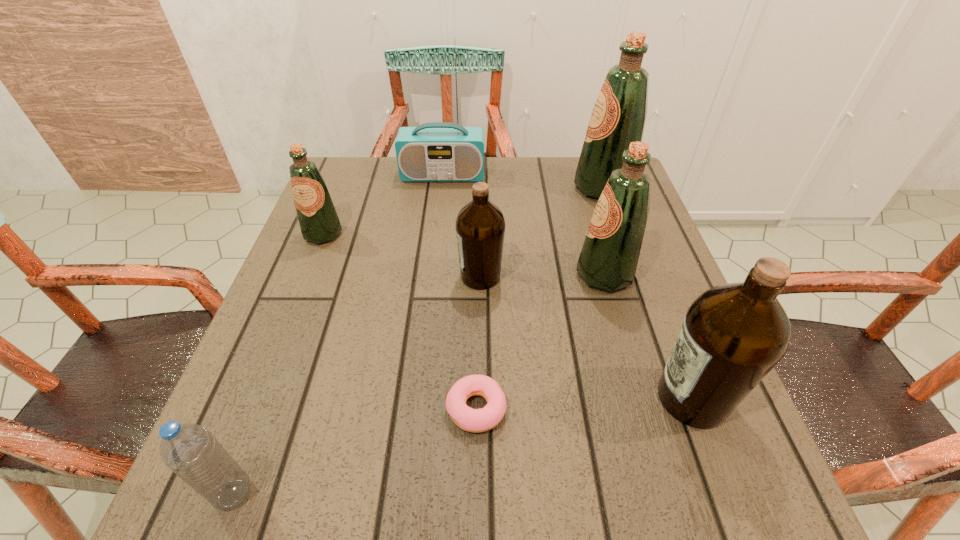
This screenshot has height=540, width=960. I want to click on vacant area that lies between the second olive oil from left to right and the sixth nearest object, so click(402, 255).

Where is `free space between the right brown olive oil and the shortest object`? The width and height of the screenshot is (960, 540). free space between the right brown olive oil and the shortest object is located at coordinates [x=584, y=403].

Find the location of a particular element. free area in between the second shortest object and the second smallest green olive oil is located at coordinates (420, 384).

Locate an element on the screen. free space between the tallest olive oil and the right brown olive oil is located at coordinates pyautogui.click(x=647, y=293).

What are the coordinates of `free spot between the left brown olive oil and the doughnut` in the screenshot? It's located at (478, 342).

Find the location of a particular element. This screenshot has width=960, height=540. vacant area between the radio receiver and the right brown olive oil is located at coordinates (567, 287).

At what (x,y) coordinates should I click in order to perform the action: click on free point between the light radio receiver and the shortest object. Please return your answer as a coordinate pair (x, y). This screenshot has width=960, height=540. Looking at the image, I should click on (460, 292).

At what (x,y) coordinates should I click in order to perform the action: click on empty location between the pink doughnut and the smaller brown olive oil. Please return your answer as a coordinate pair (x, y). The height and width of the screenshot is (540, 960). Looking at the image, I should click on (478, 342).

Where is `free space between the second farthest olive oil and the second olive oil from left to right`? Image resolution: width=960 pixels, height=540 pixels. free space between the second farthest olive oil and the second olive oil from left to right is located at coordinates (402, 255).

Where is `free point between the nearer brown olive oil and the nearest green olive oil`? This screenshot has width=960, height=540. free point between the nearer brown olive oil and the nearest green olive oil is located at coordinates (648, 336).